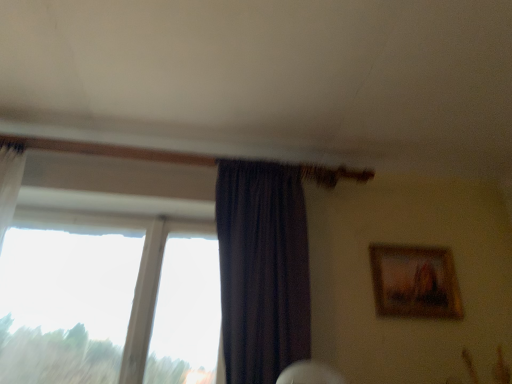
Question: Is wooden framed painting at upper right positioned behind dark purple sheer at center?

Choices:
 (A) no
 (B) yes

Answer: (B)

Question: From the image's perspective, is wooden framed painting at upper right located above dark purple sheer at center?

Choices:
 (A) no
 (B) yes

Answer: (A)

Question: Is wooden framed painting at upper right far away from dark purple sheer at center?

Choices:
 (A) yes
 (B) no

Answer: (B)

Question: Is wooden framed painting at upper right placed right next to dark purple sheer at center?

Choices:
 (A) no
 (B) yes

Answer: (A)

Question: Is the depth of wooden framed painting at upper right less than that of dark purple sheer at center?

Choices:
 (A) yes
 (B) no

Answer: (B)

Question: From a real-world perspective, relative to transparent glass window at left, is dark purple sheer at center vertically above or below?

Choices:
 (A) below
 (B) above

Answer: (B)

Question: Is dark purple sheer at center in front of or behind transparent glass window at left in the image?

Choices:
 (A) front
 (B) behind

Answer: (A)

Question: In the image, is dark purple sheer at center on the left side or the right side of transparent glass window at left?

Choices:
 (A) right
 (B) left

Answer: (A)

Question: From their relative heights in the image, would you say dark purple sheer at center is taller or shorter than transparent glass window at left?

Choices:
 (A) short
 (B) tall

Answer: (B)

Question: Considering the positions of wooden framed painting at upper right and transparent glass window at left in the image, is wooden framed painting at upper right taller or shorter than transparent glass window at left?

Choices:
 (A) short
 (B) tall

Answer: (A)

Question: Is point (422, 314) positioned closer to the camera than point (184, 372)?

Choices:
 (A) farther
 (B) closer

Answer: (B)

Question: From a real-world perspective, is wooden framed painting at upper right positioned above or below transparent glass window at left?

Choices:
 (A) below
 (B) above

Answer: (B)

Question: From the image's perspective, is wooden framed painting at upper right located above or below transparent glass window at left?

Choices:
 (A) below
 (B) above

Answer: (B)

Question: Is wooden framed painting at upper right bigger or smaller than dark purple sheer at center?

Choices:
 (A) small
 (B) big

Answer: (A)

Question: Relative to dark purple sheer at center, is wooden framed painting at upper right in front or behind?

Choices:
 (A) front
 (B) behind

Answer: (B)